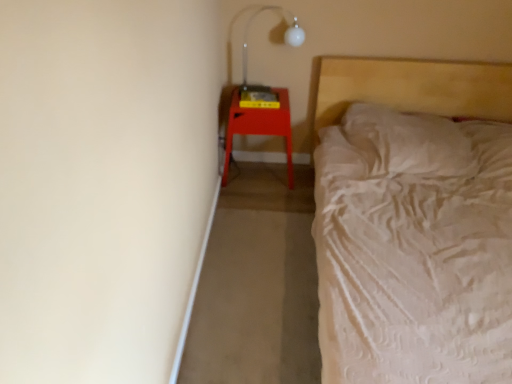
Question: Is white textured bed at right wider or thinner than matte red stool at right?

Choices:
 (A) wide
 (B) thin

Answer: (A)

Question: From a real-world perspective, relative to matte red stool at right, is white textured bed at right vertically above or below?

Choices:
 (A) above
 (B) below

Answer: (A)

Question: Estimate the real-world distances between objects in this image. Which object is farther from the white textured bed at right?

Choices:
 (A) transparent plastic lamp at upper right
 (B) matte red stool at right

Answer: (A)

Question: Which of these objects is positioned farthest from the transparent plastic lamp at upper right?

Choices:
 (A) matte red stool at right
 (B) white textured bed at right

Answer: (B)